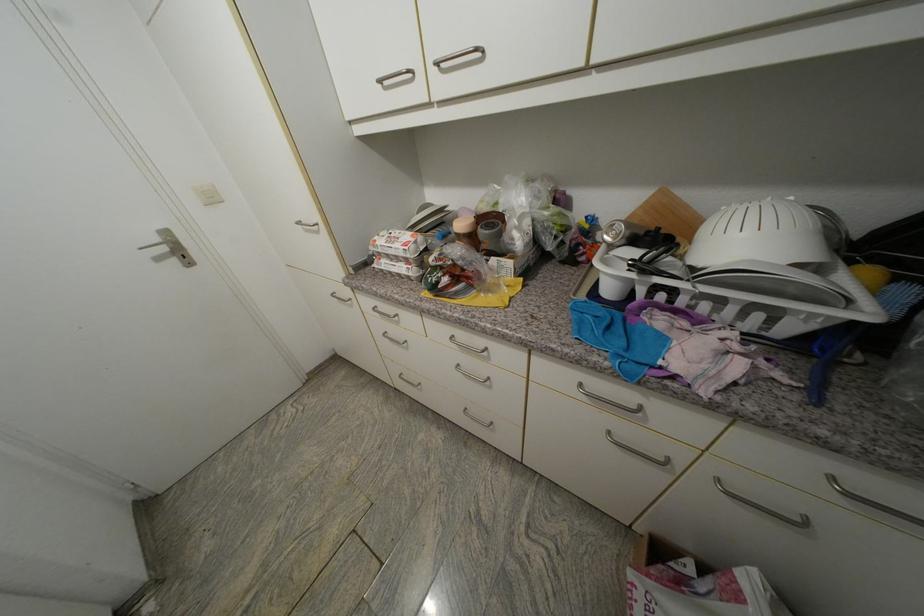
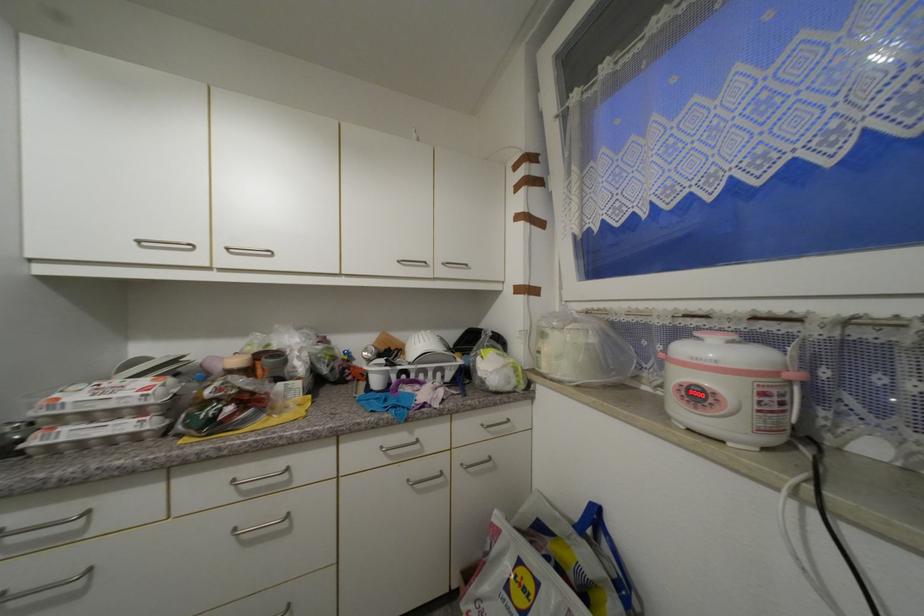
Find the pixel in the second image that matches [723,482] in the first image.

(468, 467)